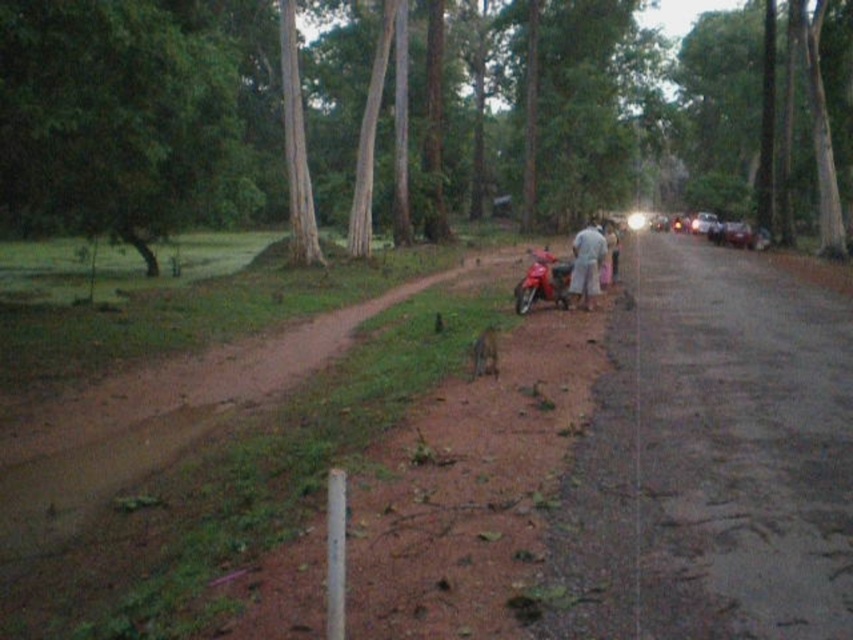
Does green leafy tree at left have a lesser width compared to light gray cotton shirt at center?

No.

Describe the element at coordinates (109, 120) in the screenshot. This screenshot has width=853, height=640. I see `green leafy tree at left` at that location.

Find the location of a particular element. The image size is (853, 640). green leafy tree at left is located at coordinates (109, 120).

Does green leafy tree at left have a lesser width compared to shiny red motorcycle at center?

No.

Does green leafy tree at left appear under shiny red motorcycle at center?

Incorrect, green leafy tree at left is not positioned below shiny red motorcycle at center.

What do you see at coordinates (109, 120) in the screenshot?
I see `green leafy tree at left` at bounding box center [109, 120].

Locate an element on the screen. Image resolution: width=853 pixels, height=640 pixels. green leafy tree at left is located at coordinates [109, 120].

Does brown smooth tree at upper center lie in front of green leafy tree at left?

No, it is not.

Describe the element at coordinates (630, 113) in the screenshot. I see `brown smooth tree at upper center` at that location.

This screenshot has width=853, height=640. In order to click on brown smooth tree at upper center in this screenshot , I will do `click(630, 113)`.